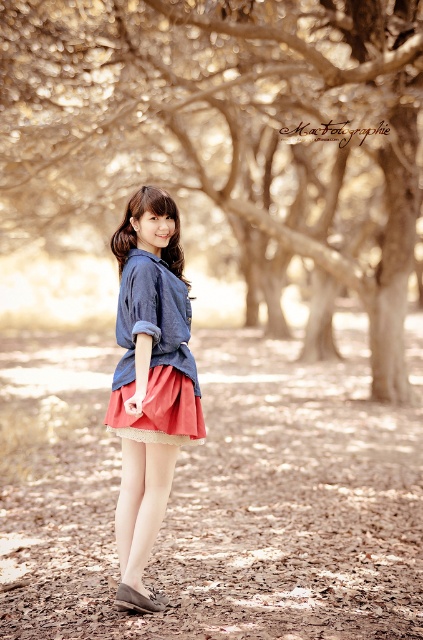
Question: Which point is closer to the camera?

Choices:
 (A) (264, 268)
 (B) (181, 275)
 (C) (153, 404)
 (D) (258, 577)

Answer: (C)

Question: Based on their relative distances, which object is farther from the matte denim shirt at center?

Choices:
 (A) brown dirt field at lower center
 (B) matte pink skirt at center

Answer: (A)

Question: Does brown textured tree at center appear over matte denim shirt at center?

Choices:
 (A) no
 (B) yes

Answer: (B)

Question: Among these points, which one is farthest from the camera?

Choices:
 (A) (266, 141)
 (B) (159, 388)
 (C) (249, 515)

Answer: (A)

Question: Does brown dirt field at lower center have a lesser width compared to matte pink skirt at center?

Choices:
 (A) yes
 (B) no

Answer: (B)

Question: Observing the image, what is the correct spatial positioning of brown dirt field at lower center in reference to matte blue shirt at center?

Choices:
 (A) right
 (B) left

Answer: (A)